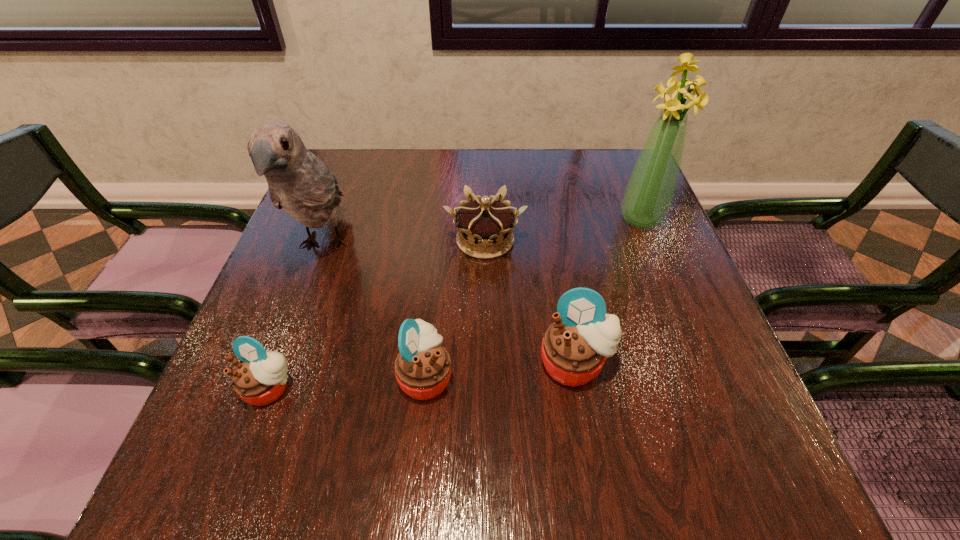
Locate an element on the screen. Image resolution: width=960 pixels, height=540 pixels. the leftmost muffin is located at coordinates (260, 377).

At what (x,y) coordinates should I click in order to perform the action: click on the fourth tallest object. Please return your answer as a coordinate pair (x, y). Image resolution: width=960 pixels, height=540 pixels. Looking at the image, I should click on click(423, 367).

Find the location of `the second muffin from right to left`. the second muffin from right to left is located at coordinates (423, 367).

Identify the location of the fifth object from left to right. (574, 349).

You are a GUI agent. You are given a task and a screenshot of the screen. Output one action in this format:
    pyautogui.click(x=<x>, y=<y>)
    Task: Click on the fifth shortest object
    This screenshot has width=960, height=540.
    Given the screenshot: What is the action you would take?
    pyautogui.click(x=298, y=181)

In order to click on crown in this screenshot , I will do `click(486, 223)`.

Where is `the rightmost object`? This screenshot has width=960, height=540. the rightmost object is located at coordinates (650, 190).

Image resolution: width=960 pixels, height=540 pixels. What are the coordinates of `vacant position located on the front-facing side of the second shortest muffin` in the screenshot? It's located at (570, 376).

The image size is (960, 540). I want to click on free spot located 0.050m on the front-facing side of the fifth object from left to right, so click(585, 419).

Locate an element on the screen. This screenshot has height=540, width=960. free spot located on the front-facing side of the parrot is located at coordinates (281, 360).